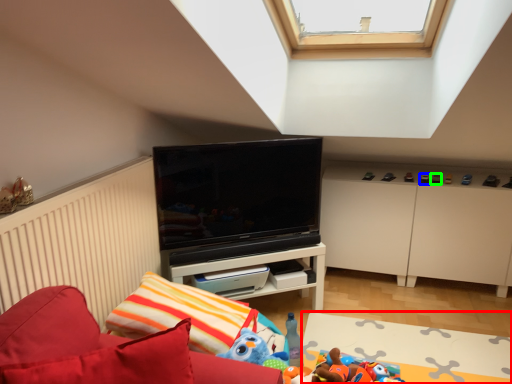
Question: Which object is the farthest from plain (highlighted by a red box)? Choose among these: toy (highlighted by a blue box) or toy (highlighted by a green box).

Choices:
 (A) toy
 (B) toy

Answer: (B)